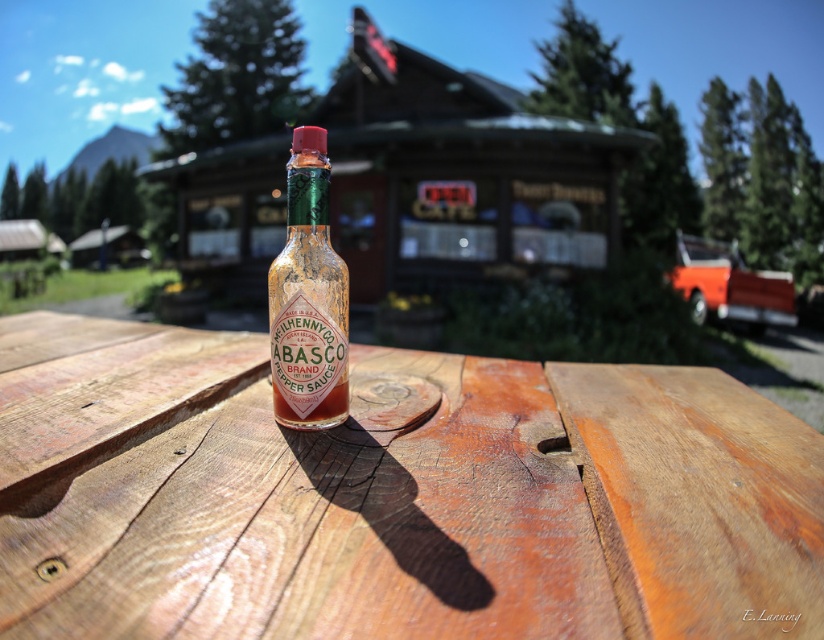
Between point (325, 534) and point (321, 394), which one is positioned in front?

Point (325, 534) is more forward.

Does point (260, 611) lie behind point (296, 220)?

No, it is in front of (296, 220).

The height and width of the screenshot is (640, 824). What do you see at coordinates (392, 497) in the screenshot?
I see `wooden picnic table at center` at bounding box center [392, 497].

The width and height of the screenshot is (824, 640). Identify the location of wooden picnic table at center. 392,497.